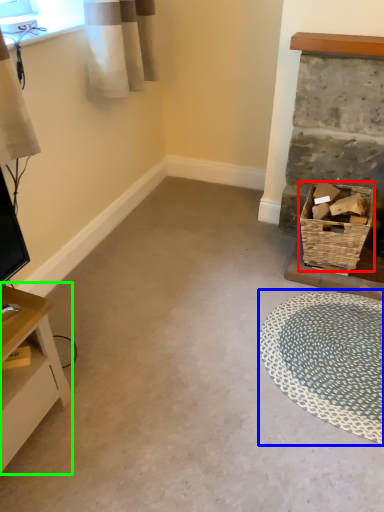
Question: Considering the real-world distances, which object is farthest from basket (highlighted by a red box)? mat (highlighted by a blue box) or table (highlighted by a green box)?

Choices:
 (A) mat
 (B) table

Answer: (B)